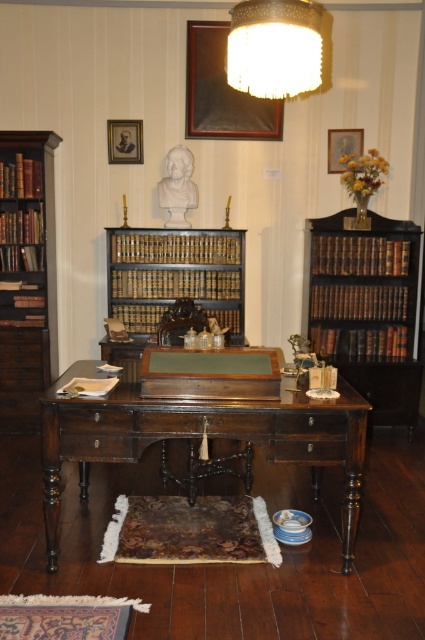
Between gold textured lampshade at upper center and brown leather book at right, which one is positioned lower?

brown leather book at right is below.

Can you confirm if gold textured lampshade at upper center is taller than brown leather book at right?

Yes, gold textured lampshade at upper center is taller than brown leather book at right.

Is point (288, 20) farther from viewer compared to point (376, 330)?

No, it is not.

You are a GUI agent. You are given a task and a screenshot of the screen. Output one action in this format:
    pyautogui.click(x=<x>, y=<y>)
    Task: Click on the gold textured lampshade at upper center
    This screenshot has width=425, height=640.
    Given the screenshot: What is the action you would take?
    pyautogui.click(x=274, y=48)

Is brown wood bookcase at center thinner than dark brown leather book at left?

Incorrect, brown wood bookcase at center's width is not less than dark brown leather book at left's.

Which is behind, point (119, 296) or point (31, 189)?

Point (119, 296)

Which is behind, point (234, 250) or point (2, 189)?

The point (234, 250) is more distant.

Locate an element on the screen. brown wood bookcase at center is located at coordinates pyautogui.click(x=172, y=280).

Can you confirm if gold textured lampshade at upper center is positioned above hardcover book at center?

Correct, gold textured lampshade at upper center is located above hardcover book at center.

Identify the location of gold textured lampshade at upper center. (274, 48).

Does point (232, 83) come in front of point (30, 253)?

That is True.

Find the location of a particular element. Image resolution: width=425 pixels, height=640 pixels. gold textured lampshade at upper center is located at coordinates (274, 48).